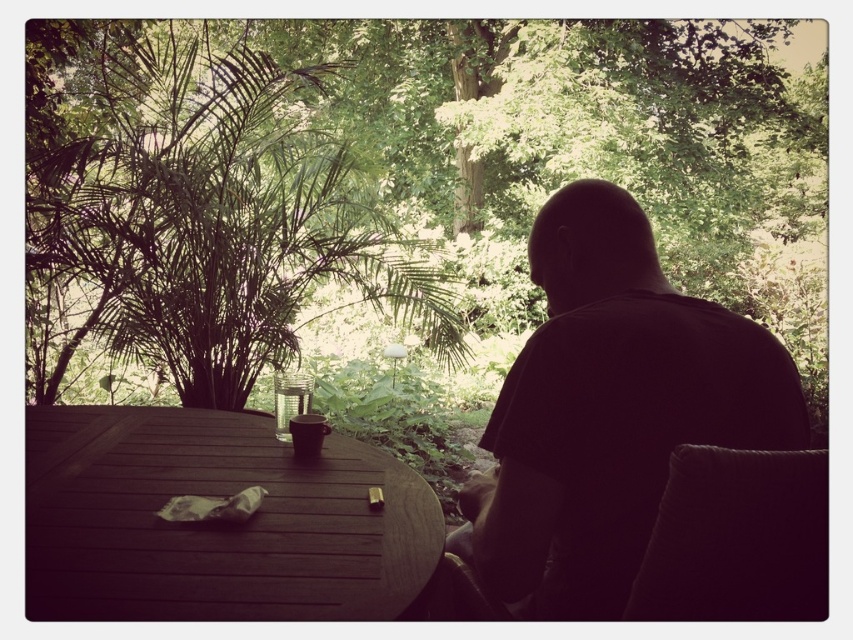
Question: Estimate the real-world distances between objects in this image. Which object is closer to the green leafy tree at upper center?

Choices:
 (A) clear glass cup at center
 (B) wooden table at center

Answer: (A)

Question: Which object is the closest to the clear glass cup at center?

Choices:
 (A) wooden table at center
 (B) dark fabric chair at right
 (C) green leafy tree at upper center

Answer: (A)

Question: Which object is closer to the camera taking this photo?

Choices:
 (A) green leafy tree at upper center
 (B) wooden table at center
 (C) black matte shirt at center

Answer: (B)

Question: Can you confirm if wooden table at center is positioned below clear glass cup at center?

Choices:
 (A) no
 (B) yes

Answer: (B)

Question: Does green leafy tree at upper center have a lesser width compared to clear glass cup at center?

Choices:
 (A) yes
 (B) no

Answer: (B)

Question: Can you confirm if green leafy tree at upper center is positioned to the left of clear glass cup at center?

Choices:
 (A) no
 (B) yes

Answer: (B)